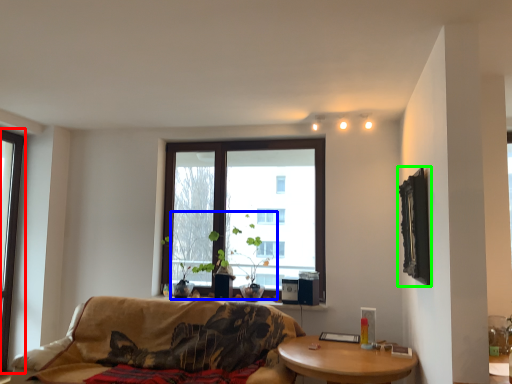
Question: Considering the real-world distances, which object is farthest from window (highlighted by a red box)? plant (highlighted by a blue box) or picture frame (highlighted by a green box)?

Choices:
 (A) plant
 (B) picture frame

Answer: (B)